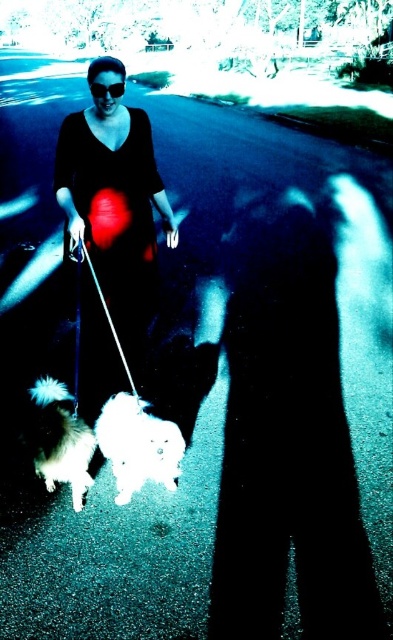
Question: Which point is farther from the camera taking this photo?

Choices:
 (A) (71, 397)
 (B) (88, 186)
 (C) (124, 444)

Answer: (B)

Question: Which object is closer to the camera taking this photo?

Choices:
 (A) black matte goggles at upper center
 (B) matte black dress at center
 (C) white fluffy dog at lower left

Answer: (C)

Question: Which point is closer to the camera?

Choices:
 (A) (115, 170)
 (B) (130, 492)

Answer: (B)

Question: Does fluffy white dog at lower left appear on the right side of black matte goggles at upper center?

Choices:
 (A) yes
 (B) no

Answer: (B)

Question: Is matte black dress at center further to camera compared to black matte goggles at upper center?

Choices:
 (A) no
 (B) yes

Answer: (A)

Question: Can you confirm if matte black dress at center is positioned to the right of white fluffy dog at lower left?

Choices:
 (A) yes
 (B) no

Answer: (B)